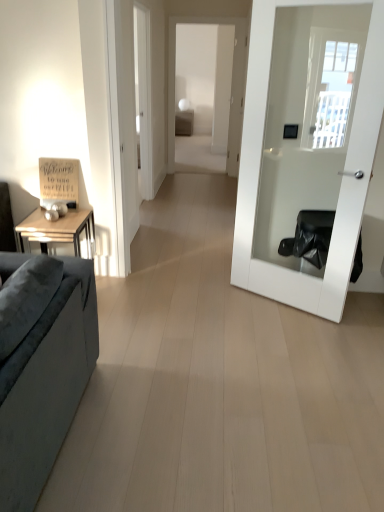
Image resolution: width=384 pixels, height=512 pixels. I want to click on free spot below white glossy door at right (from a real-world perspective), so click(x=270, y=298).